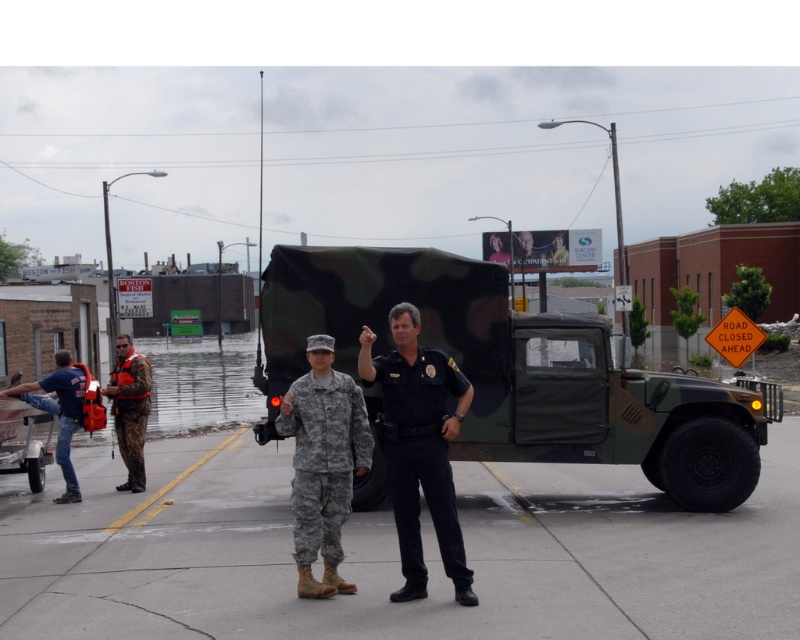
Question: Which point is farther from the camera taking this photo?

Choices:
 (A) (332, 371)
 (B) (432, 460)
 (C) (78, 378)

Answer: (C)

Question: Which object is closer to the camera taking this photo?

Choices:
 (A) blue denim jeans at lower left
 (B) camouflage fabric uniform at center

Answer: (B)

Question: Does dark blue uniform at center come in front of camouflage fabric uniform at center?

Choices:
 (A) yes
 (B) no

Answer: (A)

Question: Where is camouflage fabric truck at center located in relation to dark blue uniform at center in the image?

Choices:
 (A) right
 (B) left

Answer: (A)

Question: Which point is farther from the camera taking this photo?

Choices:
 (A) (412, 493)
 (B) (140, 376)
 (C) (342, 406)
 (D) (60, 396)

Answer: (B)

Question: Considering the relative positions of dark blue uniform at center and camouflage fabric uniform at center in the image provided, where is dark blue uniform at center located with respect to camouflage fabric uniform at center?

Choices:
 (A) below
 (B) above

Answer: (B)